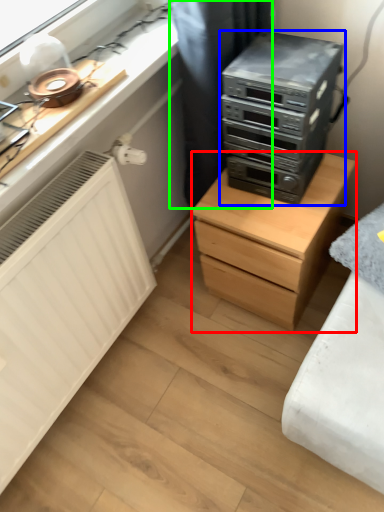
Question: Which object is the farthest from chest of drawers (highlighted by a red box)? Choose among these: home appliance (highlighted by a blue box) or curtain (highlighted by a green box).

Choices:
 (A) home appliance
 (B) curtain

Answer: (B)